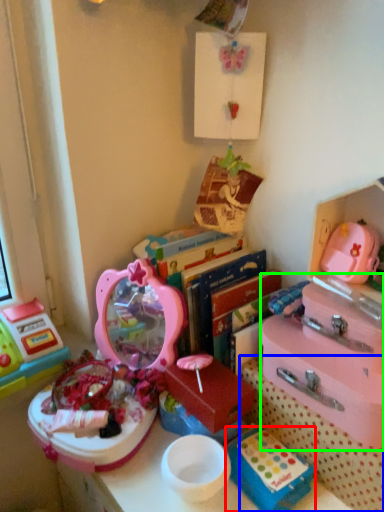
Question: Which object is the closest to the storage box (highlighted by a red box)? Choose among these: storage box (highlighted by a blue box) or storage box (highlighted by a green box).

Choices:
 (A) storage box
 (B) storage box

Answer: (A)